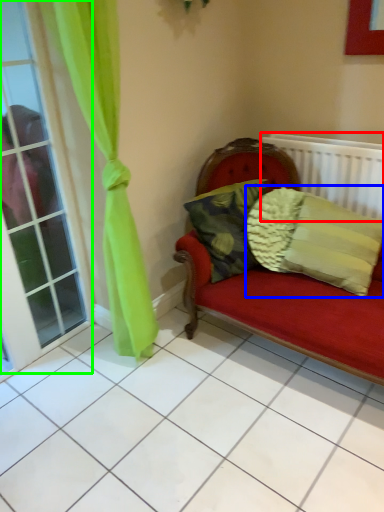
Question: Which is farther away from radiator (highlighted by a red box)? pillow (highlighted by a blue box) or window (highlighted by a green box)?

Choices:
 (A) pillow
 (B) window

Answer: (B)